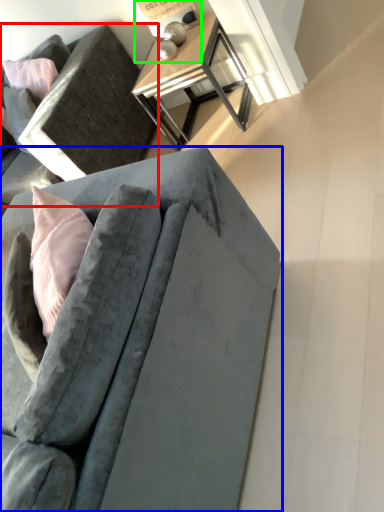
Question: Which object is the farthest from studio couch (highlighted by a red box)? Choose among these: studio couch (highlighted by a blue box) or table lamp (highlighted by a green box).

Choices:
 (A) studio couch
 (B) table lamp

Answer: (A)